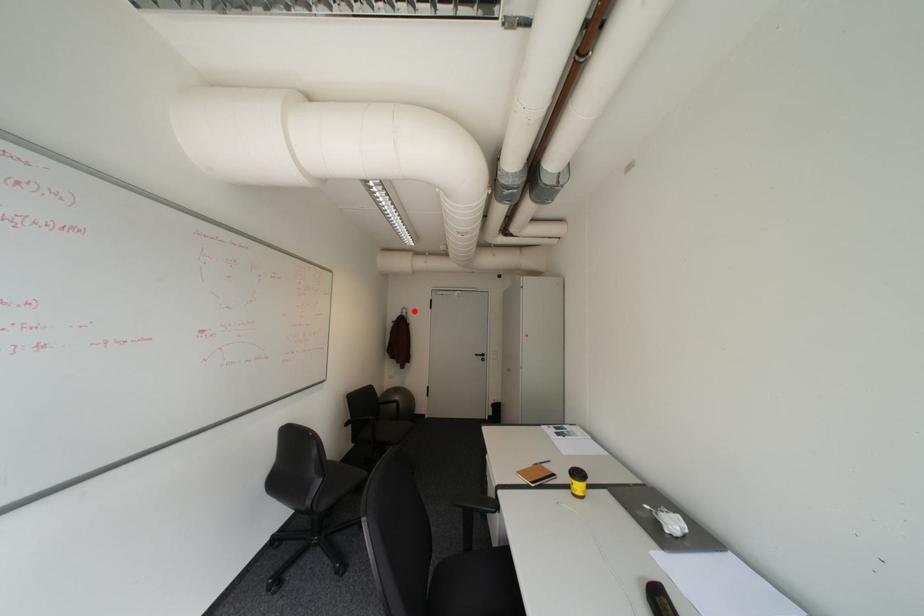
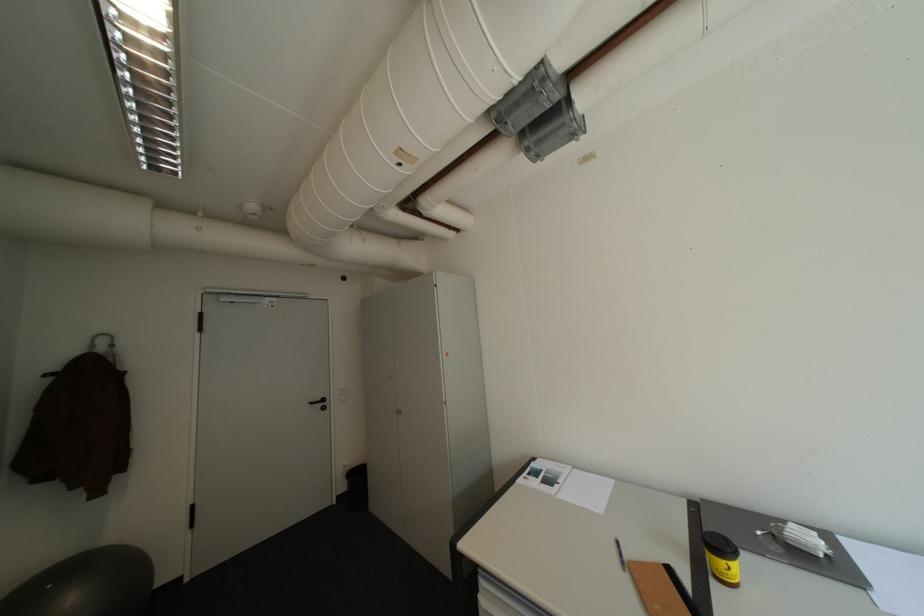
Where in the second image is the point corresponding to the highlighted location from the first image?

(113, 342)